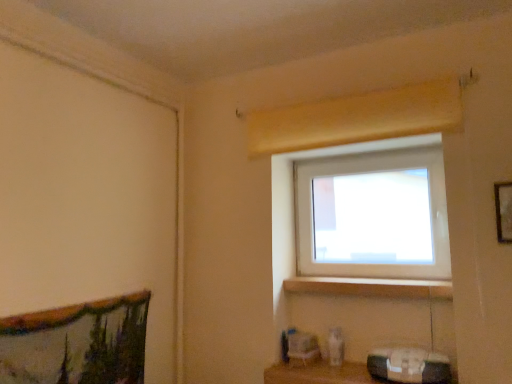
This screenshot has height=384, width=512. What are the coordinates of `free space above white plastic window at upper center (from a real-world perspective)` in the screenshot? It's located at (367, 156).